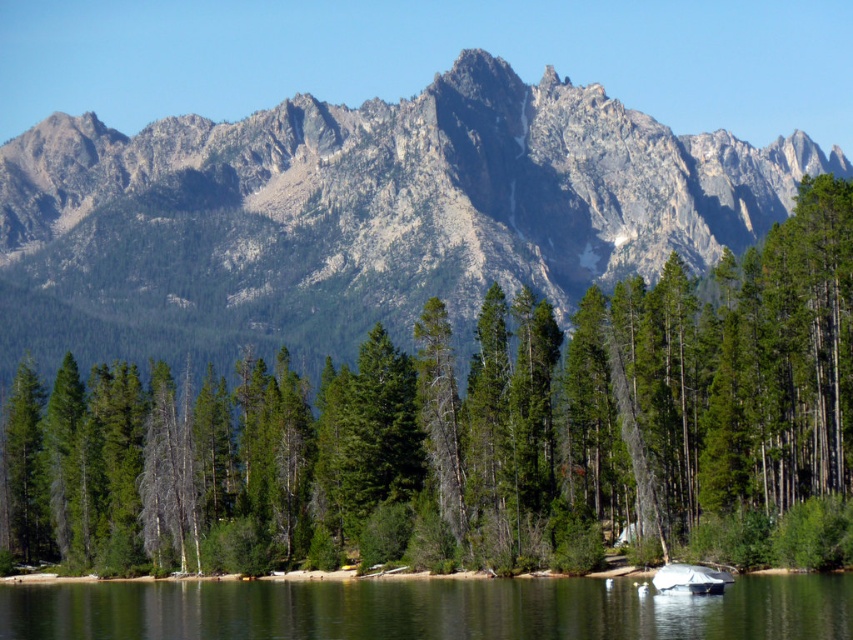
Who is taller, green matte tree at center or rocky gray mountain range at upper center?

With more height is rocky gray mountain range at upper center.

What do you see at coordinates (479, 433) in the screenshot? I see `green matte tree at center` at bounding box center [479, 433].

Image resolution: width=853 pixels, height=640 pixels. What do you see at coordinates (479, 433) in the screenshot? I see `green matte tree at center` at bounding box center [479, 433].

Where is `green matte tree at center`? green matte tree at center is located at coordinates (479, 433).

Is green matte tree at center thinner than clear water at lower center?

In fact, green matte tree at center might be wider than clear water at lower center.

Who is more distant from viewer, (57, 381) or (421, 632)?

The point (57, 381) is behind.

Identify the location of green matte tree at center. The image size is (853, 640). (479, 433).

Can you confirm if rocky gray mountain range at upper center is smaller than clear water at lower center?

No.

Who is higher up, rocky gray mountain range at upper center or clear water at lower center?

rocky gray mountain range at upper center is above.

Does point (376, 170) come behind point (396, 598)?

Yes, it is.

Locate an element on the screen. The width and height of the screenshot is (853, 640). rocky gray mountain range at upper center is located at coordinates (358, 216).